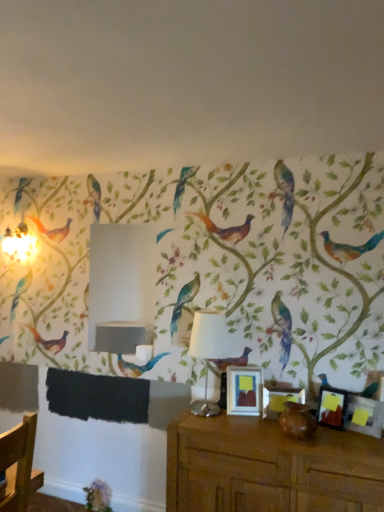
Where is `free spot in front of white fabric lampshade at center`? free spot in front of white fabric lampshade at center is located at coordinates (203, 421).